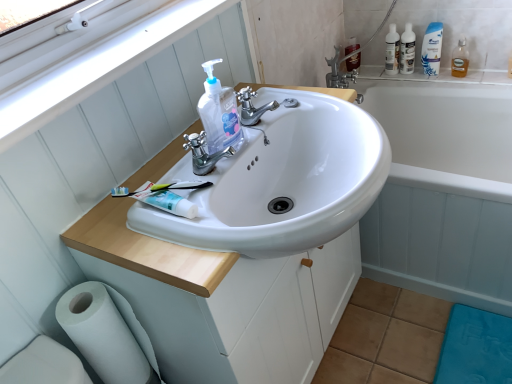
This screenshot has width=512, height=384. Find the location of `vacant area located to the right-hand side of silver metallic faucet at center, the first tap positioned from the right`. vacant area located to the right-hand side of silver metallic faucet at center, the first tap positioned from the right is located at coordinates click(308, 104).